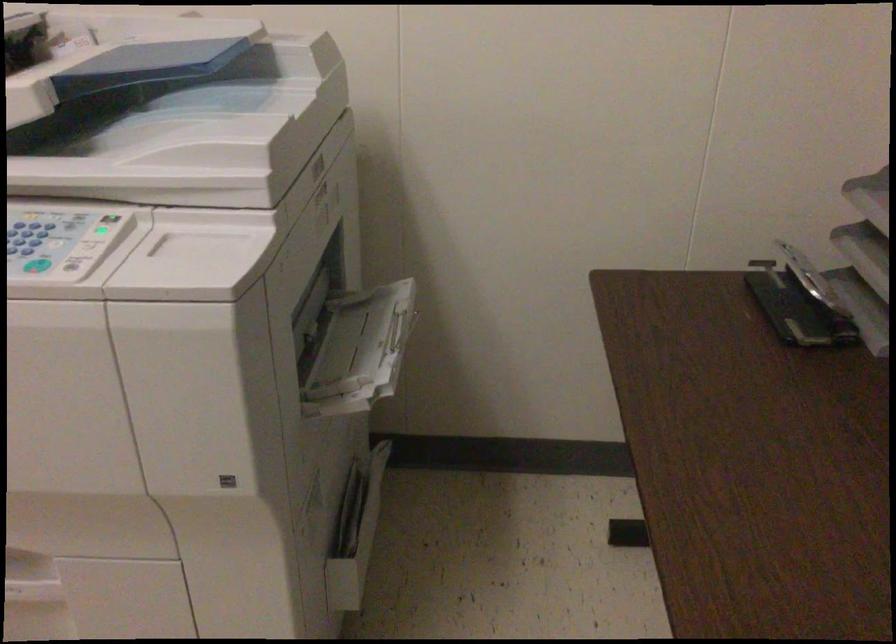
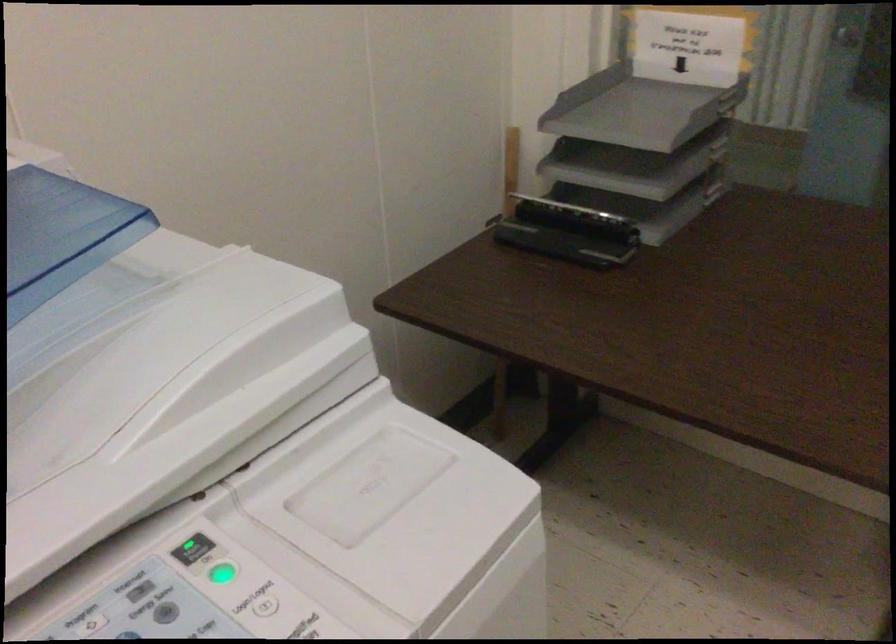
Question: The images are taken continuously from a first-person perspective. In which direction is your viewpoint rotating?

Choices:
 (A) Left
 (B) Right
 (C) Up
 (D) Down

Answer: (B)